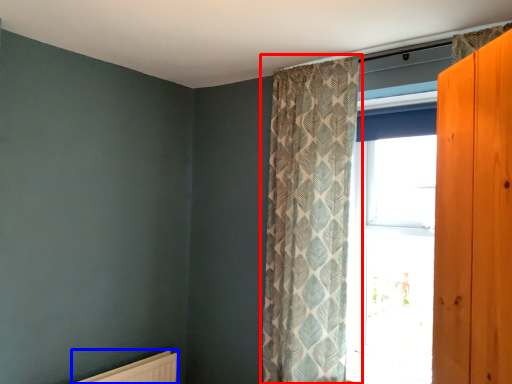
Question: Which object appears closest to the camera in this image, curtain (highlighted by a red box) or radiator (highlighted by a blue box)?

Choices:
 (A) curtain
 (B) radiator

Answer: (A)